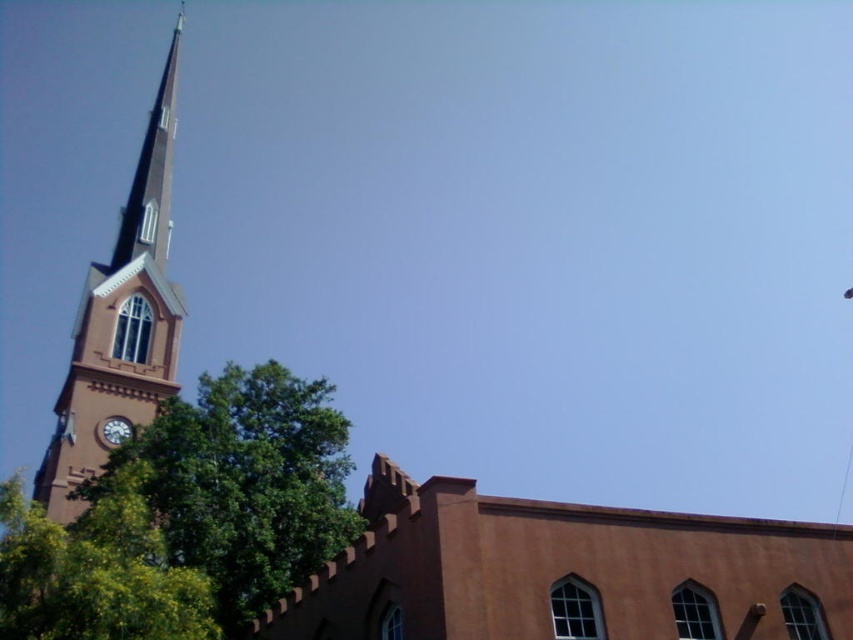
You are standing in the churchyard and want to take a photo of the brown matte church at center and the green leafy tree at lower left. Which object should you frame first in your camera to ensure both are in the shot?

The brown matte church at center is larger than the green leafy tree at lower left, so you should frame the brown matte church at center first to ensure both are in the shot.